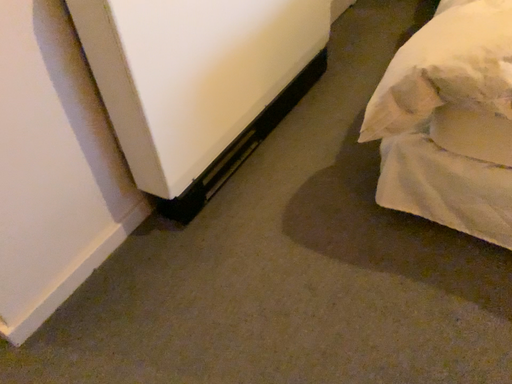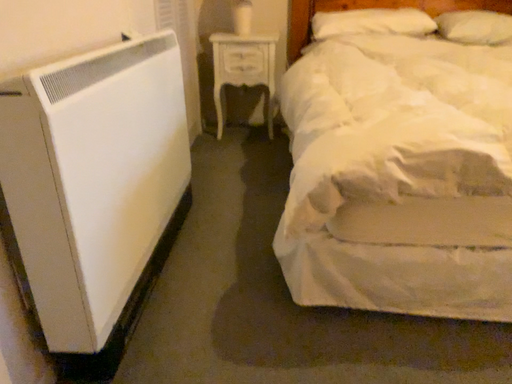
Question: Which way did the camera rotate in the video?

Choices:
 (A) rotated right
 (B) rotated left

Answer: (A)